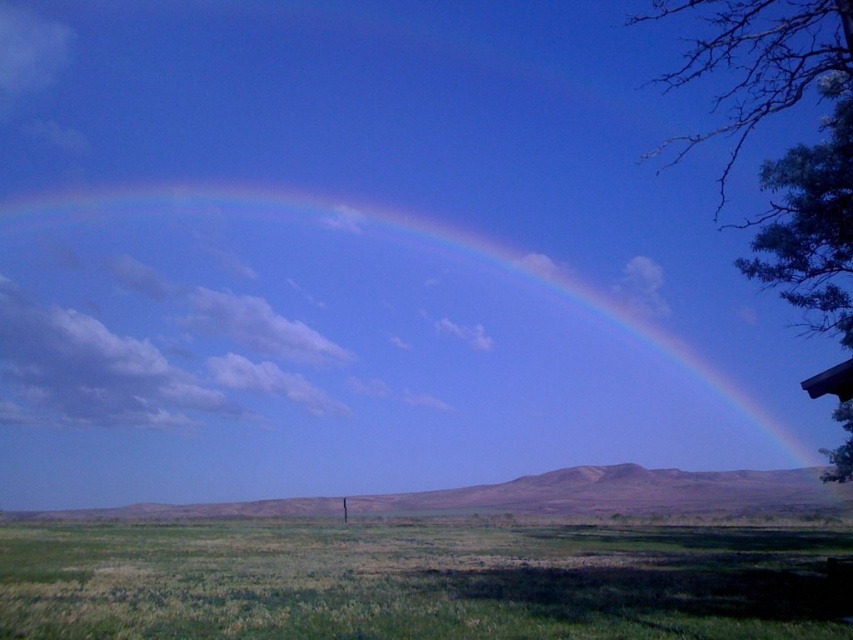
You are an astronomer analyzing the position of the rainbow at upper center in the image. What are its coordinates in the 2D plane?

The rainbow at upper center is located at coordinates (358, 349) in the 2D plane.

Based on the photo, you are standing in the middle of the green grassy field at lower center and want to look up at the rainbow at upper center. In which direction should you turn your head to see it?

You should turn your head to the left because the rainbow at upper center is positioned to the left of the green grassy field at lower center where you are standing.

You are standing in the middle of the green grassy field at lower center and looking up at the rainbow at upper center. Which object is closer to your eyes?

The rainbow at upper center is closer to your eyes because the green grassy field at lower center is behind it.